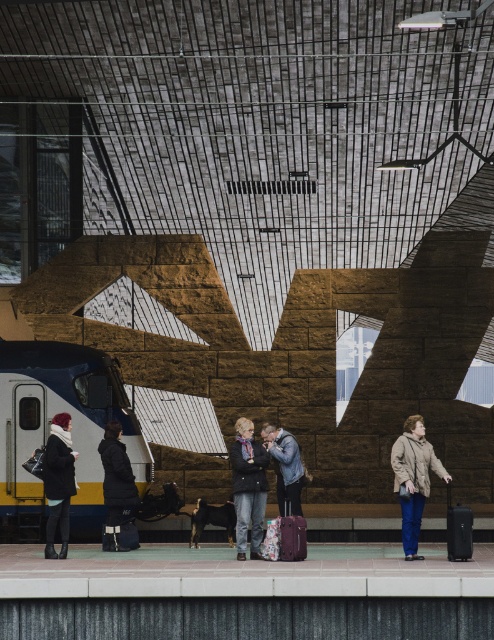
Can you confirm if dark gray coat at center is positioned to the left of denim jacket at center?

Yes, dark gray coat at center is to the left of denim jacket at center.

Which is behind, point (118, 499) or point (273, 444)?

The point (118, 499) is behind.

Where is `dark gray coat at center`? This screenshot has width=494, height=640. dark gray coat at center is located at coordinates (118, 492).

Between denim jacket at center and matte purple suitcase at center, which one appears on the left side from the viewer's perspective?

denim jacket at center is more to the left.

Describe the element at coordinates (285, 465) in the screenshot. This screenshot has width=494, height=640. I see `denim jacket at center` at that location.

Where is `denim jacket at center`? Image resolution: width=494 pixels, height=640 pixels. denim jacket at center is located at coordinates (285, 465).

The image size is (494, 640). What do you see at coordinates (118, 492) in the screenshot? I see `dark gray coat at center` at bounding box center [118, 492].

Can you confirm if dark gray coat at center is shorter than matte purple suitcase at center?

In fact, dark gray coat at center may be taller than matte purple suitcase at center.

Identify the location of dark gray coat at center. Image resolution: width=494 pixels, height=640 pixels. (118, 492).